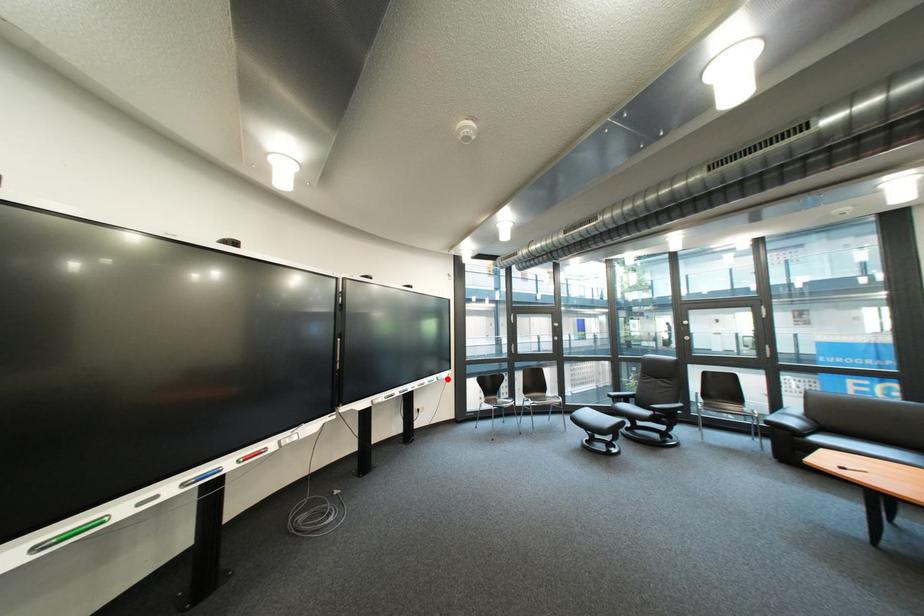
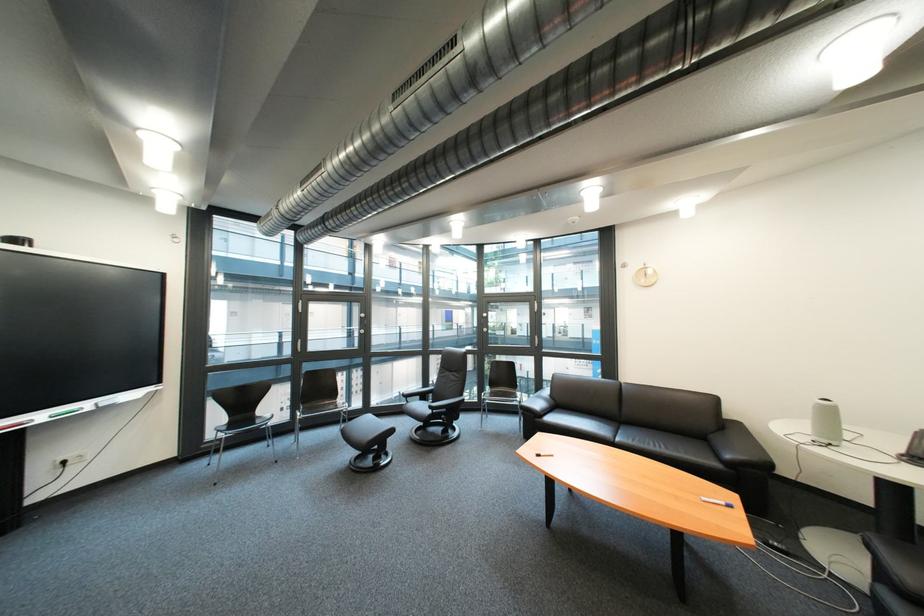
Find the pixel in the second image that matches the highlighted location in the first image.

(101, 406)